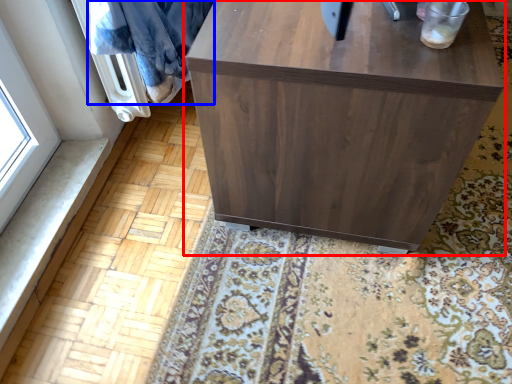
Question: Which of the following is the farthest to the observer, furniture (highlighted by a red box) or blanket (highlighted by a blue box)?

Choices:
 (A) furniture
 (B) blanket

Answer: (B)